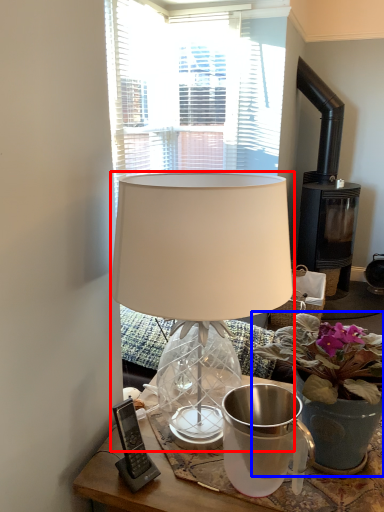
Question: Which object appears closest to the camera in this image, lamp (highlighted by a red box) or houseplant (highlighted by a blue box)?

Choices:
 (A) lamp
 (B) houseplant

Answer: (A)